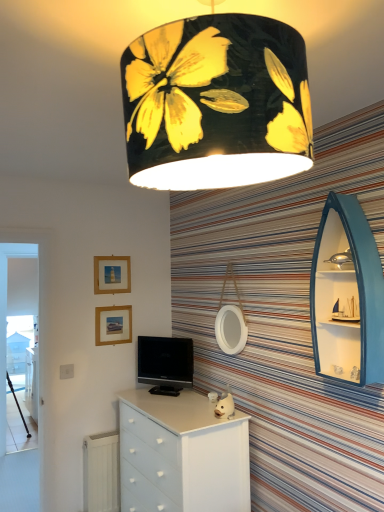
Question: Looking at their shapes, would you say matte gold picture frame at upper left, the first picture frame in the top-to-bottom sequence, is wider or thinner than white glossy chest of drawers at center?

Choices:
 (A) thin
 (B) wide

Answer: (A)

Question: From the image's perspective, is matte gold picture frame at upper left, placed as the 2th picture frame when sorted from bottom to top, positioned above or below white glossy chest of drawers at center?

Choices:
 (A) below
 (B) above

Answer: (B)

Question: Which object is positioned closest to the wooden tripod at left?

Choices:
 (A) black glossy television at center
 (B) matte gold picture frame at upper left, placed as the 2th picture frame when sorted from bottom to top
 (C) white matte radiator at lower left
 (D) transparent glass screen door at left
 (E) wooden picture frame at upper left, which is counted as the second picture frame, starting from the top

Answer: (D)

Question: Considering the real-world distances, which object is closest to the white glossy chest of drawers at center?

Choices:
 (A) white matte radiator at lower left
 (B) matte gold picture frame at upper left, the first picture frame in the top-to-bottom sequence
 (C) black glossy television at center
 (D) teal wood boat-shaped shelf at right
 (E) transparent glass screen door at left

Answer: (C)